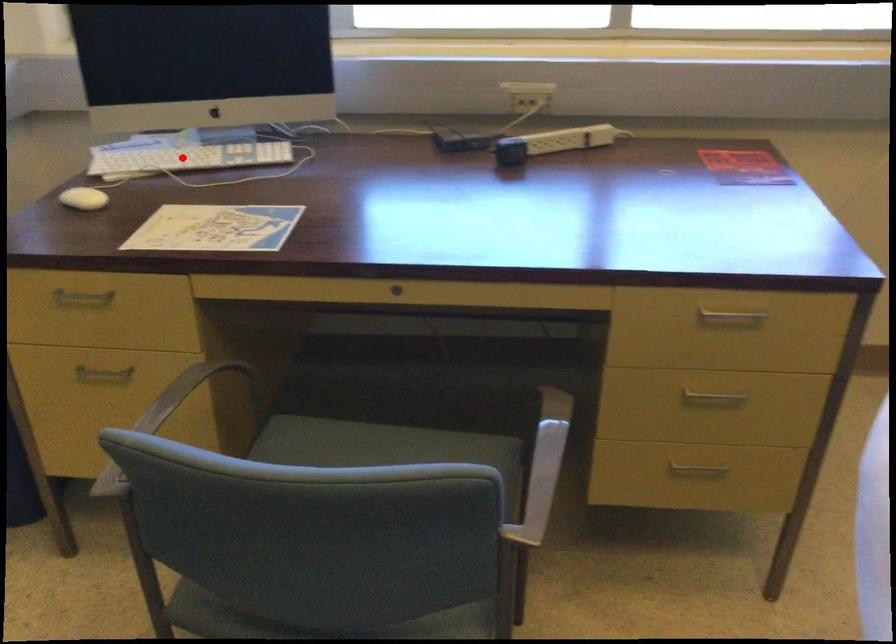
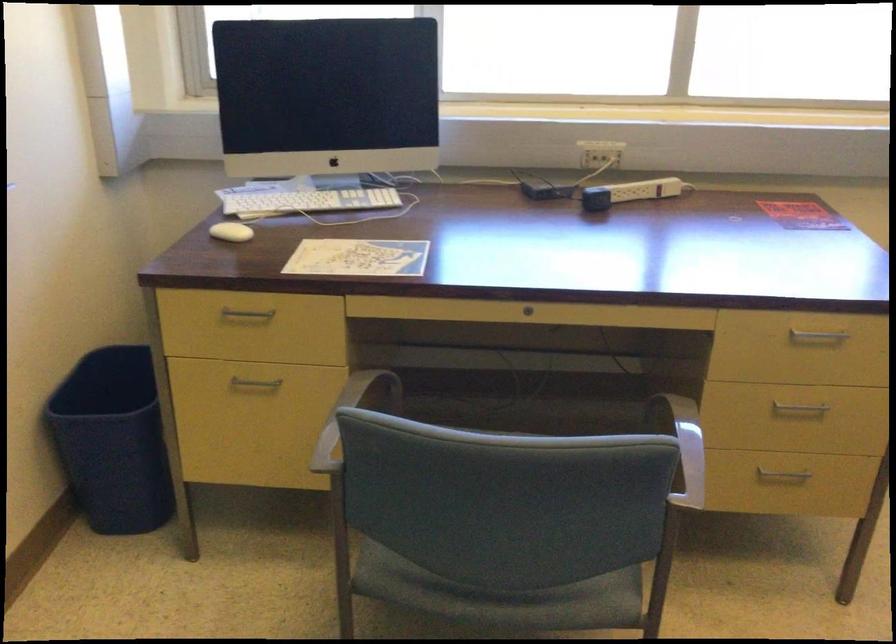
Question: I am providing you with two images of the same scene from different viewpoints. Given a red point in image1, look at the same physical point in image2. Is it:

Choices:
 (A) Closer to the viewpoint
 (B) Farther from the viewpoint

Answer: (B)